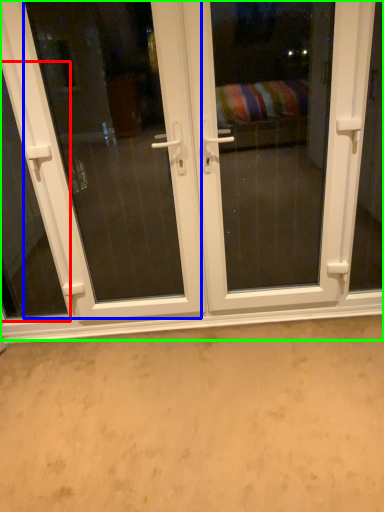
Question: Which object is positioned closest to window (highlighted by a red box)? Select from screen door (highlighted by a blue box) and door (highlighted by a green box).

Choices:
 (A) screen door
 (B) door

Answer: (B)